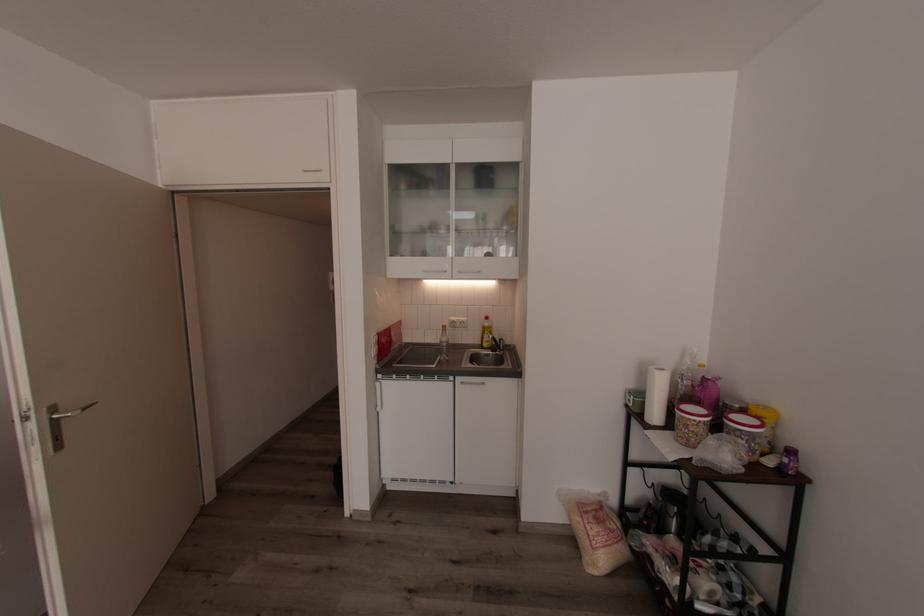
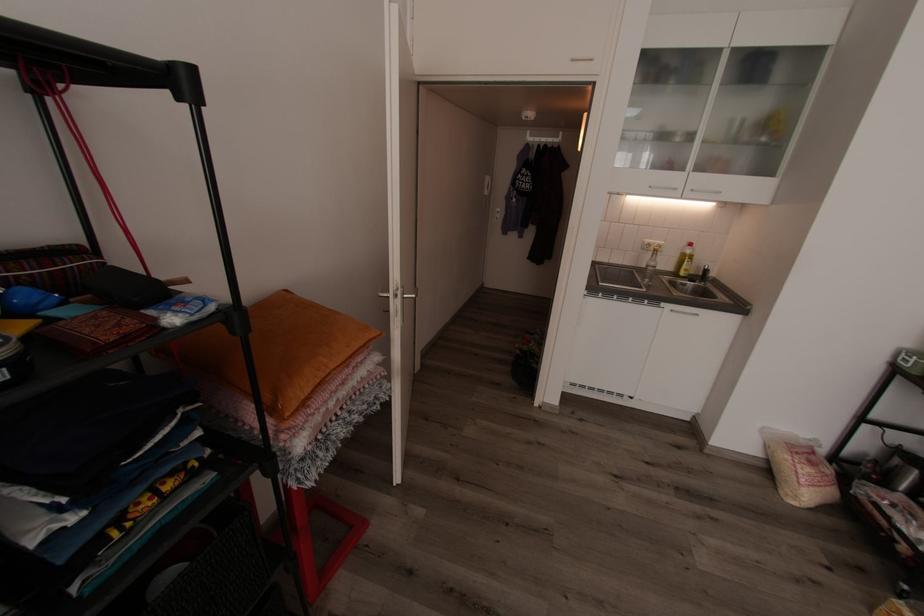
Question: The images are taken continuously from a first-person perspective. In which direction are you moving?

Choices:
 (A) Left
 (B) Right
 (C) Forward
 (D) Backward

Answer: (A)